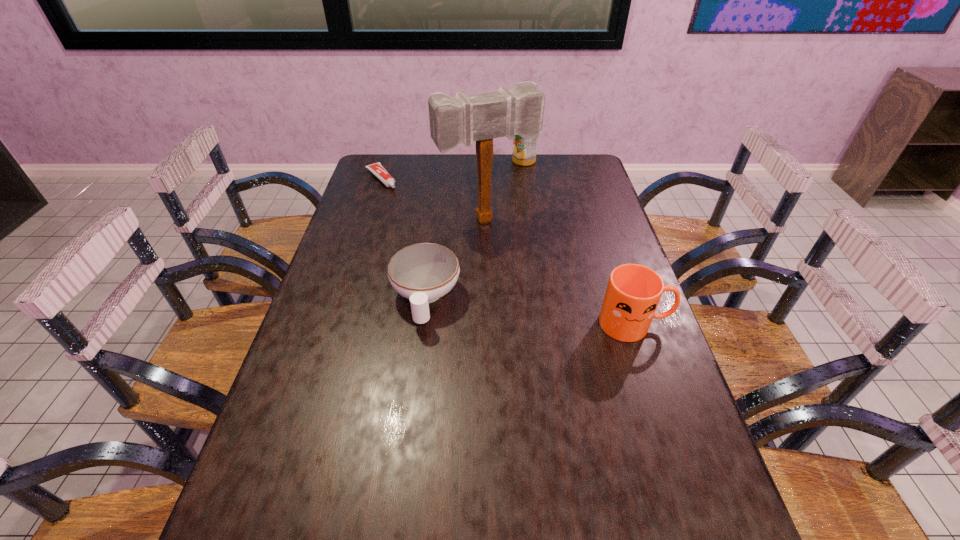
Identify the location of free location that satisfies the following two spatial constraints: 1. on the side with the handle of the third shortest object; 2. on the handle side of the fourth tallest object. The width and height of the screenshot is (960, 540). (422, 323).

The height and width of the screenshot is (540, 960). Find the location of `free space that satisfies the following two spatial constraints: 1. on the back side of the tallest object; 2. on the right side of the fourth shortest object`. free space that satisfies the following two spatial constraints: 1. on the back side of the tallest object; 2. on the right side of the fourth shortest object is located at coordinates (485, 161).

You are a GUI agent. You are given a task and a screenshot of the screen. Output one action in this format:
    pyautogui.click(x=<x>, y=<y>)
    Task: Click on the vacant area in the image that satisfies the following two spatial constraints: 1. on the back side of the shortest object; 2. on the left side of the fruit juice
    The image size is (960, 540).
    Given the screenshot: What is the action you would take?
    pyautogui.click(x=387, y=161)

Find the location of a particular element. This screenshot has width=960, height=540. blank space that satisfies the following two spatial constraints: 1. on the side with the handle of the mug; 2. on the handle side of the second shortest object is located at coordinates (422, 323).